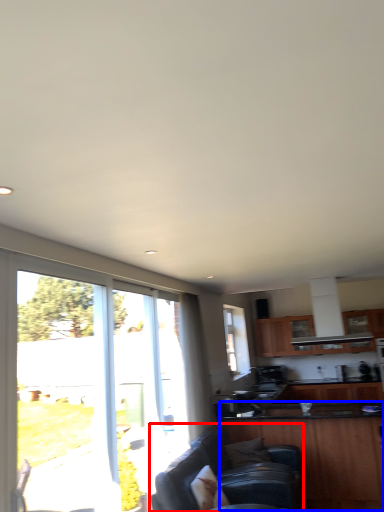
Question: Which point is further to the camera, studio couch (highlighted by a red box) or cabinetry (highlighted by a blue box)?

Choices:
 (A) studio couch
 (B) cabinetry

Answer: (B)